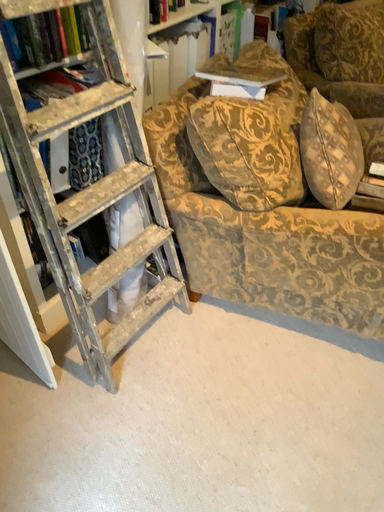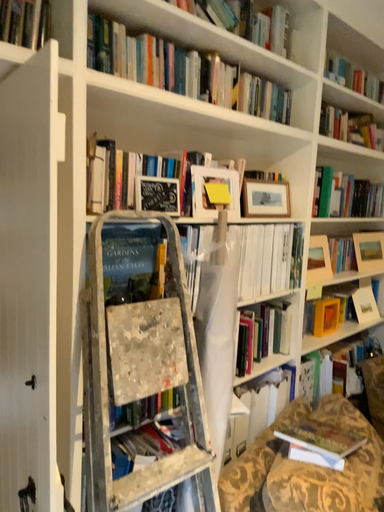
Question: Which way did the camera rotate in the video?

Choices:
 (A) rotated right
 (B) rotated left

Answer: (B)